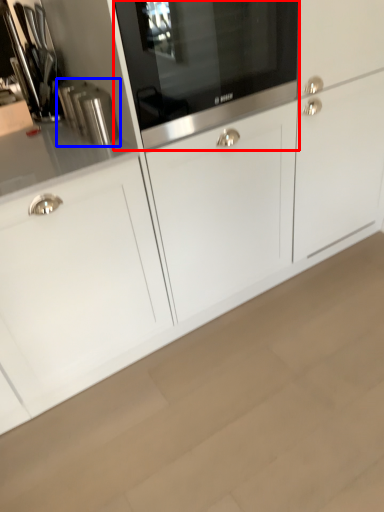
Question: Which object appears farthest to the camera in this image, home appliance (highlighted by a red box) or kitchen appliance (highlighted by a blue box)?

Choices:
 (A) home appliance
 (B) kitchen appliance

Answer: (B)